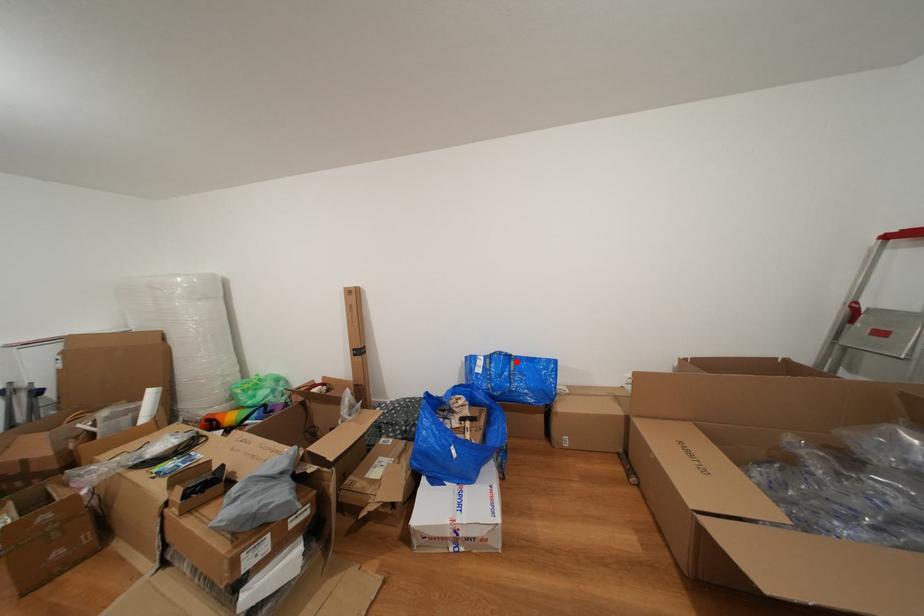
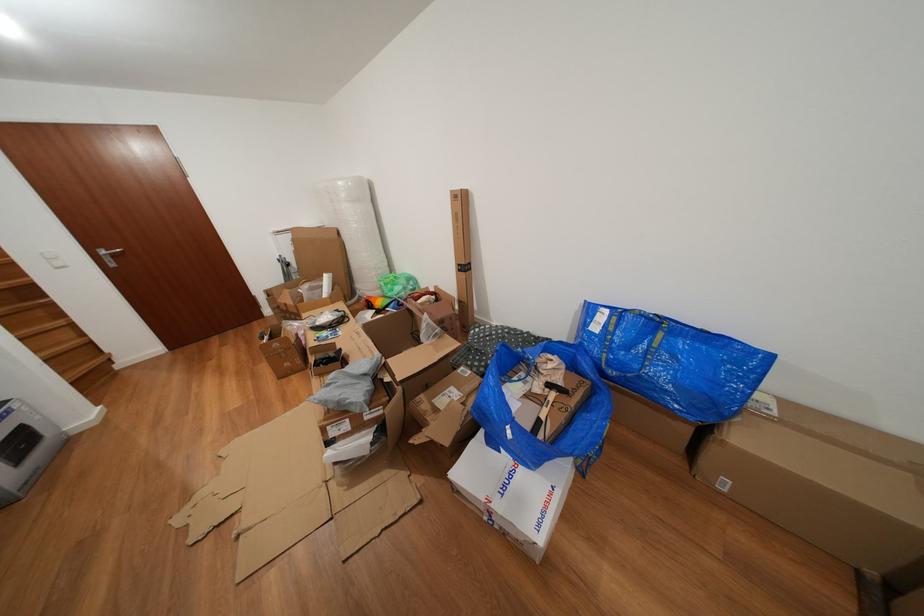
In the second image, find the point that corresponds to the highlighted location in the first image.

(663, 328)